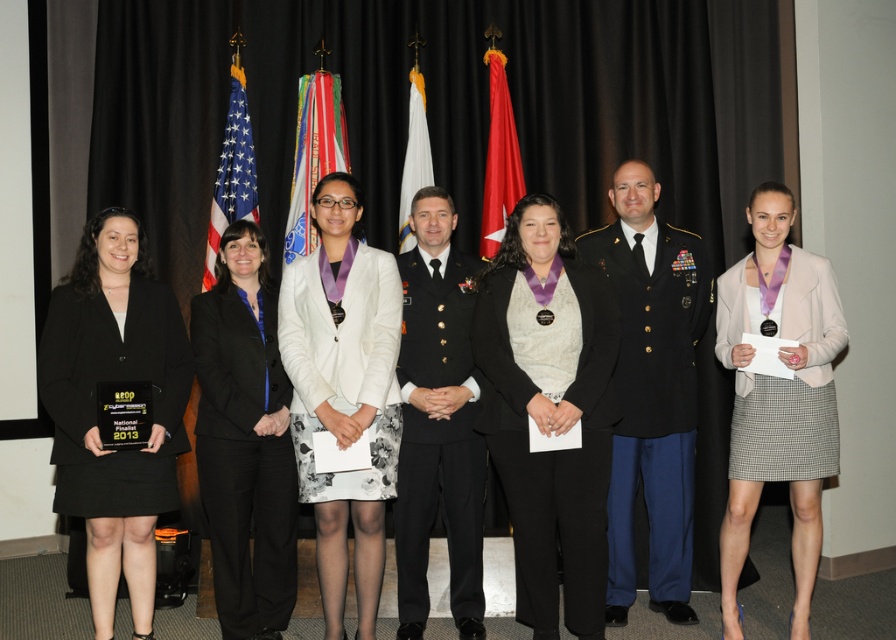
Is dark blue military uniform at center behind light beige wool jacket at center?

Yes, dark blue military uniform at center is behind light beige wool jacket at center.

Find the location of a particular element. The image size is (896, 640). dark blue military uniform at center is located at coordinates (651, 388).

Is point (672, 280) positioned in front of point (737, 406)?

No.

Where is `dark blue military uniform at center`? dark blue military uniform at center is located at coordinates (651, 388).

From the picture: Can you confirm if black matte blazer at left is positioned to the left of black fabric pants at center?

Yes, black matte blazer at left is to the left of black fabric pants at center.

Who is lower down, black matte blazer at left or black fabric pants at center?

black fabric pants at center

Measure the distance between point (179,324) and camera.

Point (179,324) is 3.73 meters from camera.

Find the location of a particular element. The image size is (896, 640). black matte blazer at left is located at coordinates (96, 410).

Who is shorter, black matte blazer at left or white fabric flag at center?

Standing shorter between the two is white fabric flag at center.

Is point (67, 280) behind point (419, 92)?

No, it is not.

Which is behind, point (93, 284) or point (421, 164)?

Positioned behind is point (421, 164).

Locate an element on the screen. black matte blazer at left is located at coordinates (96, 410).